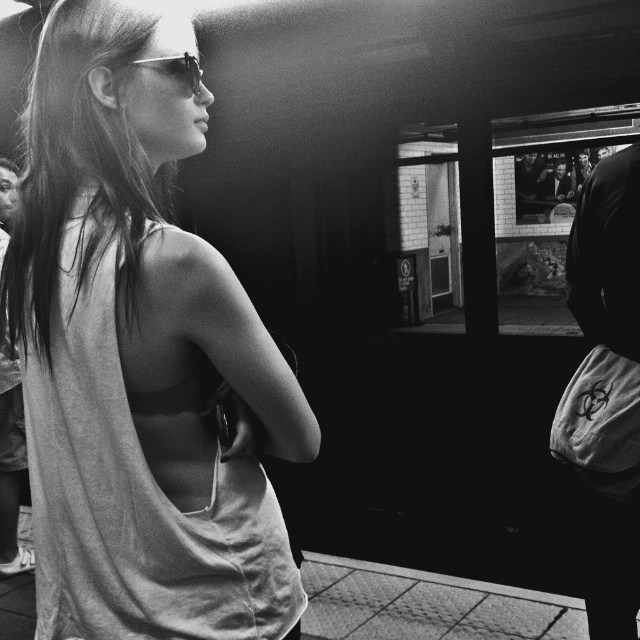
Question: Which object appears farthest from the camera in this image?

Choices:
 (A) shiny metallic sunglasses at center
 (B) matte white tank top at center

Answer: (A)

Question: Can you confirm if matte white tank top at center is positioned above shiny metallic sunglasses at center?

Choices:
 (A) no
 (B) yes

Answer: (A)

Question: Which point appears farthest from the camera in this image?

Choices:
 (A) (74, 490)
 (B) (177, 56)

Answer: (B)

Question: Does matte white tank top at center have a greater width compared to shiny metallic sunglasses at center?

Choices:
 (A) no
 (B) yes

Answer: (B)

Question: Is matte white tank top at center positioned behind shiny metallic sunglasses at center?

Choices:
 (A) yes
 (B) no

Answer: (B)